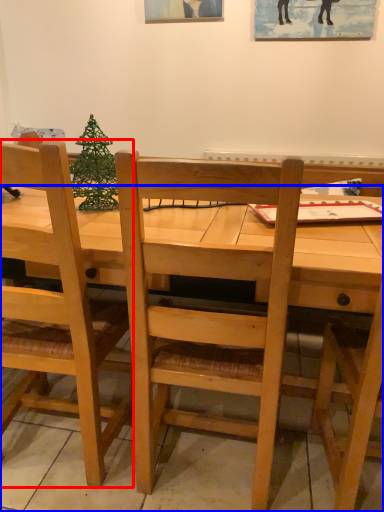
Question: Which object appears farthest to the camera in this image, chair (highlighted by a red box) or desk (highlighted by a blue box)?

Choices:
 (A) chair
 (B) desk

Answer: (B)